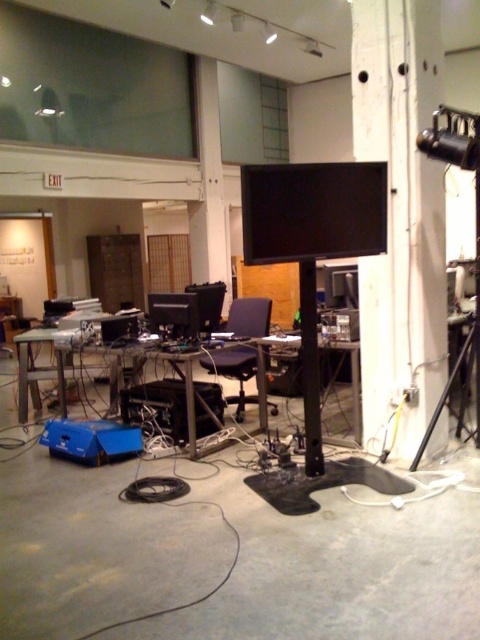
You are sitting in the black plastic swivel chair at center in the studio. You need to reach the black plastic table at center to grab your tools. Can you easily reach it from your current position?

The black plastic table at center is behind the black plastic swivel chair at center, so you would need to swivel around or get out of the chair to reach it. It is not easily reachable from your current position.

Consider the image. You are a person who is 5 feet tall. You want to sit on the black plastic swivel chair at center and reach the black plastic table at center. Can you comfortably reach the table without stretching?

The distance between the black plastic swivel chair at center and the black plastic table at center is 20.08 inches. Since the average arm length for a 5 foot tall person is around 24 inches, you can comfortably reach the table without stretching.